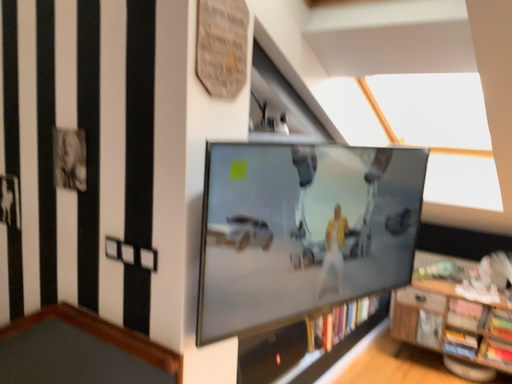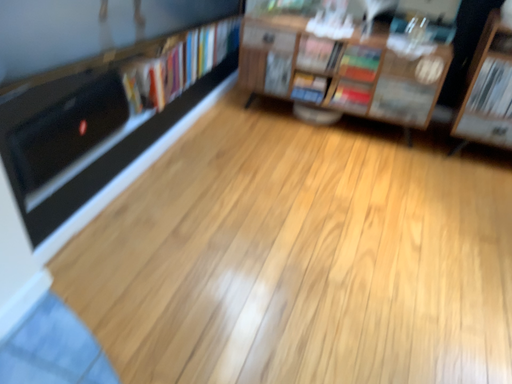
Question: Which way did the camera rotate in the video?

Choices:
 (A) rotated left
 (B) rotated right

Answer: (B)